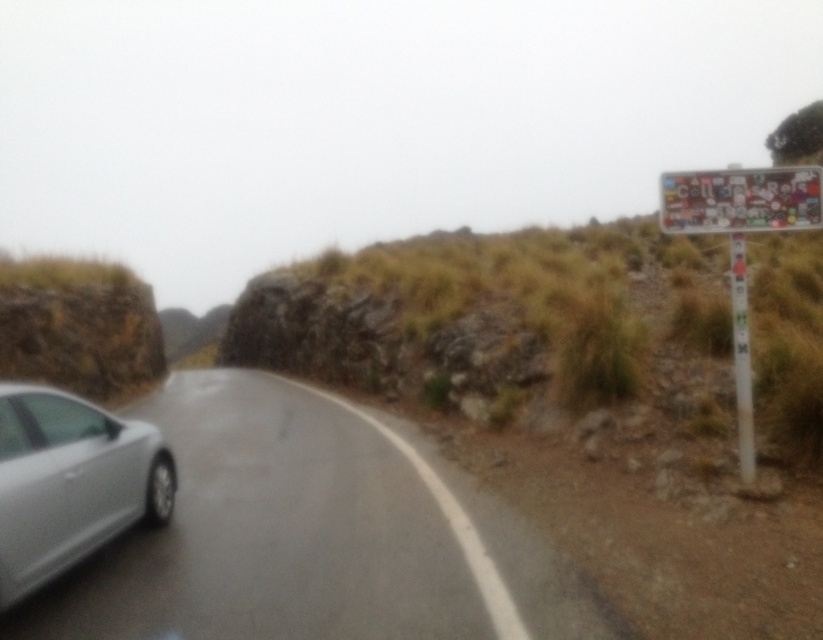
You are a passenger in a car driving on the curving road in the image. You notice a point marked at coordinates (70, 483). Based on the scene description, where is this point located relative to the satin silver car at left?

The point marked at coordinates (70, 483) is located on the satin silver car at left.

You are driving a car and need to pass the silver metallic car at left on this curving road. Based on the road layout and the car position, can you safely overtake the car without crossing the dashed white line?

The silver metallic car at left is located at point (312, 536), which means it is positioned on the left side of the road. Since the road has a dashed white line in the center, it indicates that overtaking is permitted in this section. Therefore, you can safely overtake the silver metallic car at left by staying within your lane and using the dashed line section without crossing it unnecessarily.

You are driving a car that is 4.5 meters long. You need to make a U turn on the road between the satin silver car at left and the multicolored stickers at right. Is there enough space for your car to complete the U turn without moving either object?

The distance between the satin silver car at left and the multicolored stickers at right is 6.24 meters. Since your car is 4.5 meters long, there is sufficient space to make the U turn as the available space is longer than the car.